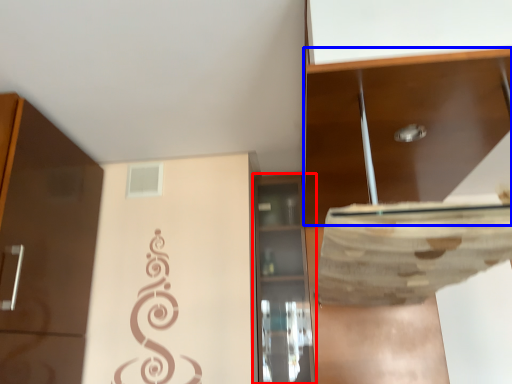
Question: Which of the following is the closest to the observer, cabinetry (highlighted by a red box) or cabinetry (highlighted by a blue box)?

Choices:
 (A) cabinetry
 (B) cabinetry

Answer: (B)